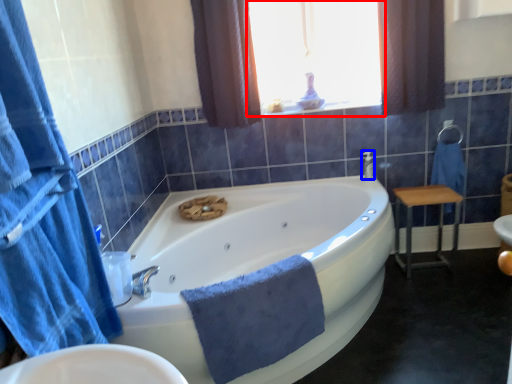
Question: Which object appears farthest to the camera in this image, window (highlighted by a red box) or faucet (highlighted by a blue box)?

Choices:
 (A) window
 (B) faucet

Answer: (B)